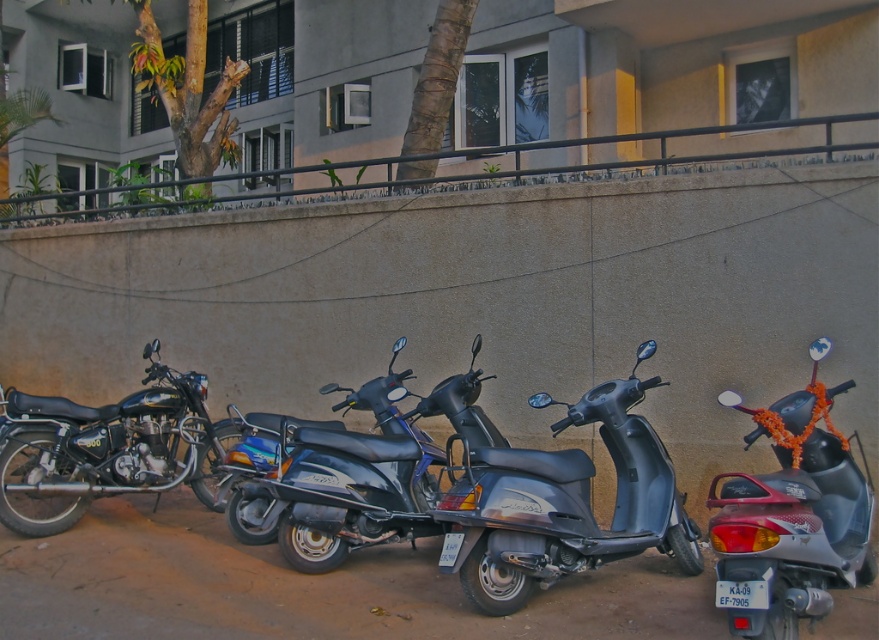
Question: Where is metallic gray scooter at center located in relation to shiny black motorcycle at left in the image?

Choices:
 (A) below
 (B) above

Answer: (A)

Question: Which object appears closest to the camera in this image?

Choices:
 (A) shiny black motorcycle at left
 (B) metallic gray scooter at center

Answer: (B)

Question: Which of the following is the farthest from the observer?

Choices:
 (A) (725, 497)
 (B) (200, 440)

Answer: (B)

Question: Which object is the farthest from the shiny black motorcycle at left?

Choices:
 (A) silver metallic scooter at right
 (B) metallic gray scooter at center

Answer: (A)

Question: Does metallic gray scooter at center appear on the left side of silver metallic scooter at right?

Choices:
 (A) no
 (B) yes

Answer: (B)

Question: Does metallic gray scooter at center appear under silver metallic scooter at right?

Choices:
 (A) yes
 (B) no

Answer: (A)